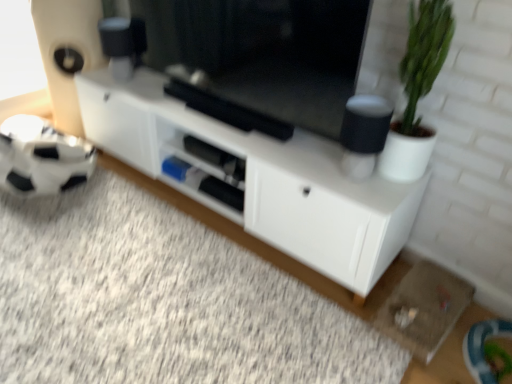
At what (x,y) coordinates should I click in order to perform the action: click on green matte plant at right. Please return your answer as a coordinate pair (x, y). This screenshot has width=512, height=384. Looking at the image, I should click on (417, 90).

The width and height of the screenshot is (512, 384). What do you see at coordinates (417, 90) in the screenshot?
I see `green matte plant at right` at bounding box center [417, 90].

Find the location of a particular element. green matte plant at right is located at coordinates (417, 90).

Which object is thinner, white matte cabinet at center or green matte plant at right?

Thinner between the two is green matte plant at right.

From a real-world perspective, is white matte cabinet at center on top of green matte plant at right?

Incorrect, from a real-world perspective, white matte cabinet at center is lower than green matte plant at right.

In the image, is white matte cabinet at center on the left side or the right side of green matte plant at right?

From the image, it's evident that white matte cabinet at center is to the left of green matte plant at right.

Which of these two, white matte cabinet at center or green matte plant at right, stands taller?

green matte plant at right is taller.

Consider the image. Are black matte tv at center and white matte cabinet at center far apart?

That's not correct — black matte tv at center is a little close to white matte cabinet at center.

Is black matte tv at center aimed at white matte cabinet at center?

No.

From a real-world perspective, between black matte tv at center and white matte cabinet at center, who is vertically higher?

black matte tv at center, from a real-world perspective.

Considering the relative positions of black matte tv at center and white matte cabinet at center in the image provided, is black matte tv at center to the left of white matte cabinet at center from the viewer's perspective?

In fact, black matte tv at center is to the right of white matte cabinet at center.

Based on the photo, is black matte tv at center facing towards green matte plant at right?

No, black matte tv at center is not facing towards green matte plant at right.

From the image's perspective, who appears lower, black matte tv at center or green matte plant at right?

From the image's view, green matte plant at right is below.

Is black matte tv at center taller or shorter than green matte plant at right?

Considering their sizes, black matte tv at center has less height than green matte plant at right.

Could green matte plant at right be considered to be inside black matte tv at center?

No, green matte plant at right is not inside black matte tv at center.

Is white matte cabinet at center bigger or smaller than black matte tv at center?

Clearly, white matte cabinet at center is larger in size than black matte tv at center.

From a real-world perspective, is white matte cabinet at center under black matte tv at center?

Yes, from a real-world perspective, white matte cabinet at center is beneath black matte tv at center.

Is white matte cabinet at center turned away from black matte tv at center?

No.

Does green matte plant at right have a lesser width compared to black matte tv at center?

Incorrect, the width of green matte plant at right is not less than that of black matte tv at center.

From the image's perspective, which is above, green matte plant at right or black matte tv at center?

black matte tv at center.

Is green matte plant at right bigger than black matte tv at center?

Actually, green matte plant at right might be smaller than black matte tv at center.

Measure the distance between green matte plant at right and black matte tv at center.

green matte plant at right is 20.97 inches from black matte tv at center.

Which is in front, green matte plant at right or white matte cabinet at center?

green matte plant at right is more forward.

From the image's perspective, relative to white matte cabinet at center, is green matte plant at right above or below?

Based on their image positions, green matte plant at right is located above white matte cabinet at center.

Considering the relative sizes of green matte plant at right and white matte cabinet at center in the image provided, is green matte plant at right wider than white matte cabinet at center?

In fact, green matte plant at right might be narrower than white matte cabinet at center.

The height and width of the screenshot is (384, 512). I want to click on houseplant located in front of the white matte cabinet at center, so click(x=417, y=90).

You are a GUI agent. You are given a task and a screenshot of the screen. Output one action in this format:
    pyautogui.click(x=<x>, y=<y>)
    Task: Click on the cabinetry directly beneath the green matte plant at right (from a real-world perspective)
    
    Given the screenshot: What is the action you would take?
    pyautogui.click(x=255, y=176)

Locate an element on the screen. window screen located above the white matte cabinet at center (from the image's perspective) is located at coordinates (255, 58).

Looking at the image, which one is located further to green matte plant at right, white matte cabinet at center or black matte tv at center?

white matte cabinet at center.

In the scene shown: Based on their spatial positions, is white matte cabinet at center or green matte plant at right further from black matte tv at center?

green matte plant at right is further to black matte tv at center.

Considering their positions, is green matte plant at right positioned closer to white matte cabinet at center than black matte tv at center?

Based on the image, black matte tv at center appears to be nearer to white matte cabinet at center.

Considering their positions, is black matte tv at center positioned closer to white matte cabinet at center than green matte plant at right?

Among the two, black matte tv at center is located nearer to white matte cabinet at center.

From the image, which object appears to be farther from green matte plant at right, black matte tv at center or white matte cabinet at center?

The object further to green matte plant at right is white matte cabinet at center.

Based on the photo, considering their positions, is green matte plant at right positioned further to black matte tv at center than white matte cabinet at center?

Among the two, green matte plant at right is located further to black matte tv at center.

The image size is (512, 384). Find the location of `window screen between white matte cabinet at center and green matte plant at right`. window screen between white matte cabinet at center and green matte plant at right is located at coordinates tap(255, 58).